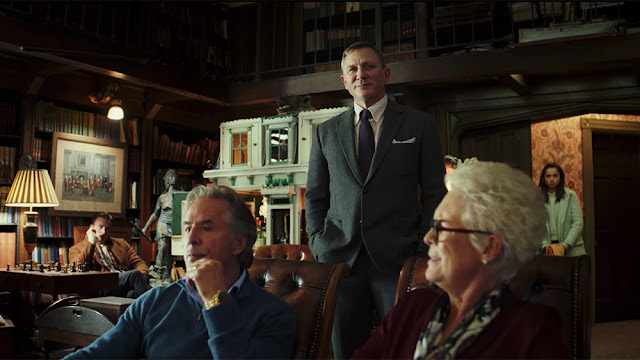
Locate an element on the screen. The image size is (640, 360). door is located at coordinates (150, 133), (148, 180), (28, 99), (29, 132), (225, 114), (482, 142), (507, 143), (524, 160).